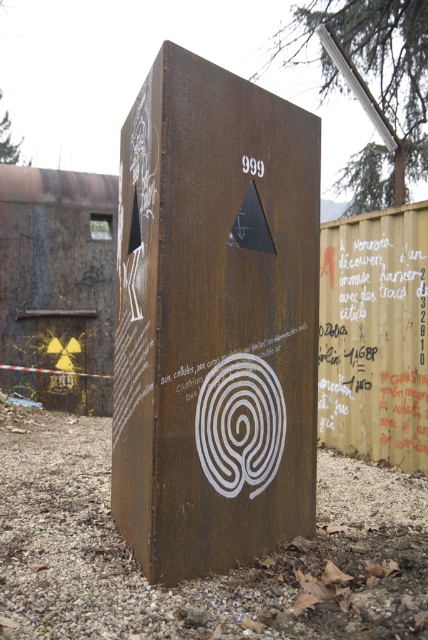
Who is positioned more to the left, rusty metal box at center or red painted text at right?

rusty metal box at center

Describe the element at coordinates (214, 321) in the screenshot. I see `rusty metal box at center` at that location.

Which is behind, point (133, 355) or point (401, 426)?

The point (401, 426) is more distant.

I want to click on rusty metal box at center, so pos(214,321).